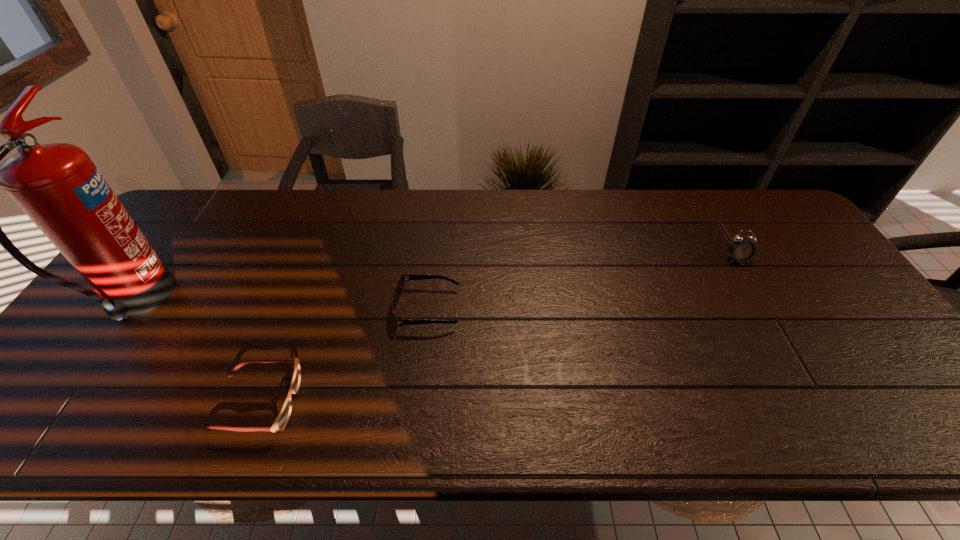
Find the location of a particular element. empty space that is in between the spectacles and the sunglasses is located at coordinates (343, 356).

Where is `vacant point located between the second tallest object and the nearest object`? The height and width of the screenshot is (540, 960). vacant point located between the second tallest object and the nearest object is located at coordinates (497, 331).

The image size is (960, 540). Identify the location of vacant area between the leftmost object and the rightmost object. (437, 281).

I want to click on blank region between the leftmost object and the sunglasses, so click(282, 306).

This screenshot has width=960, height=540. What are the coordinates of `vacant space that is in between the leftmost object and the sunglasses` in the screenshot? It's located at (282, 306).

The width and height of the screenshot is (960, 540). Identify the location of free spot between the spectacles and the third shortest object. (497, 331).

Locate an element on the screen. The height and width of the screenshot is (540, 960). unoccupied area between the sunglasses and the spectacles is located at coordinates (343, 356).

Identify the location of free space that is in between the nearest object and the fire extinguisher. (197, 353).

Identify which object is the third closest to the alarm clock. Please provide its 2D coordinates. Your answer should be formatted as a tuple, i.e. [(x, y)], where the tuple contains the x and y coordinates of a point satisfying the conditions above.

[(58, 186)]

Identify the location of object that stands as the closest to the farthest object. The height and width of the screenshot is (540, 960). (398, 289).